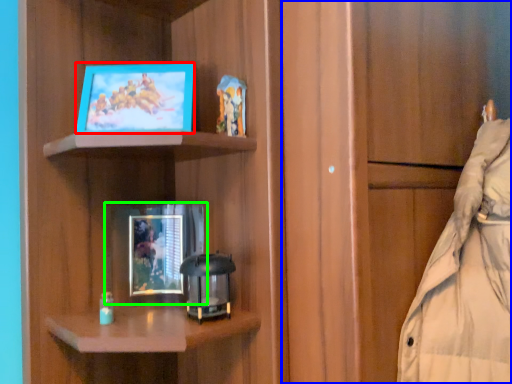
Question: Which object is the closest to the picture frame (highlighted by a red box)? Choose among these: cabinetry (highlighted by a blue box) or picture frame (highlighted by a green box).

Choices:
 (A) cabinetry
 (B) picture frame

Answer: (B)